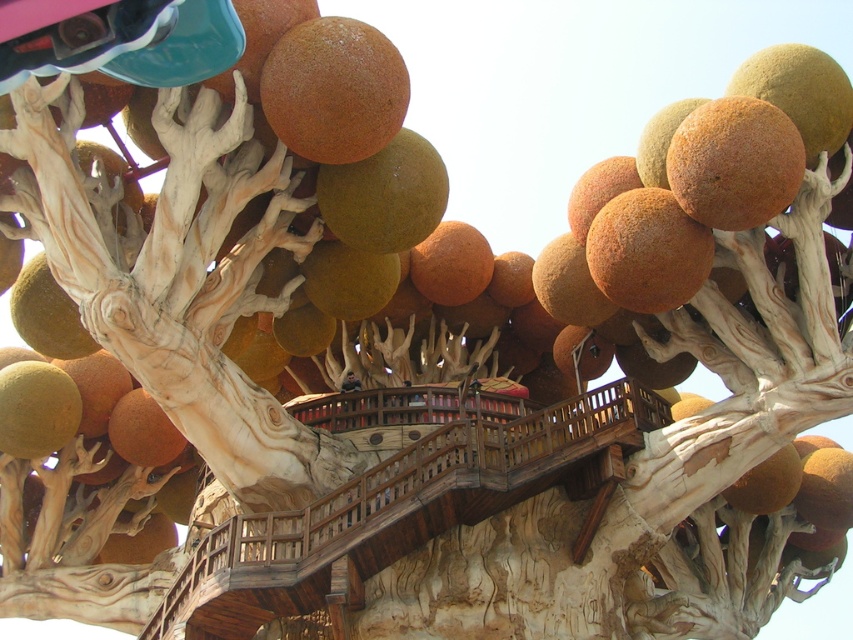
You are standing at the base of the treehouse and want to place a new decorative sphere exactly where the rustic textured sphere at upper center is currently located. What coordinates should you aim for?

The rustic textured sphere at upper center is located at coordinates point (x=334, y=90), so you should aim for those coordinates to place the new decorative sphere.